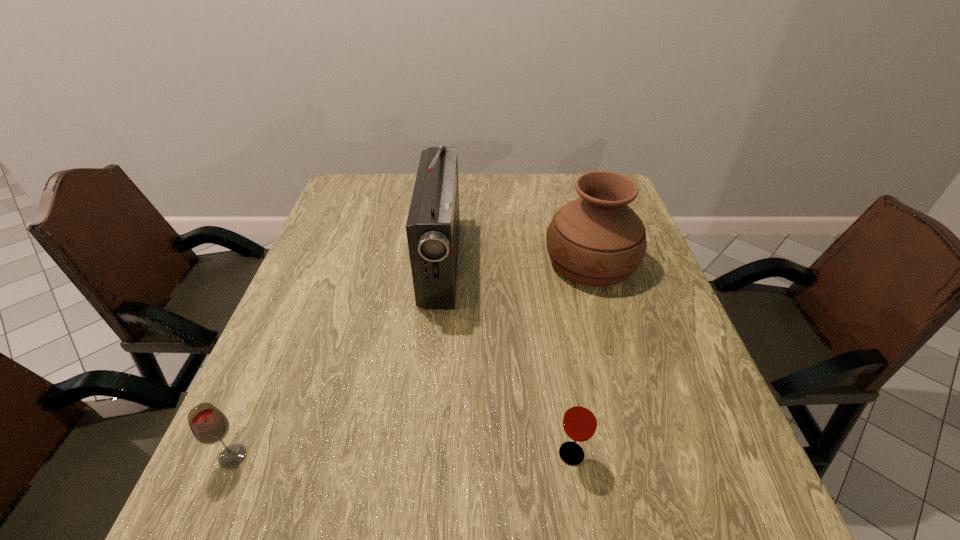
What are the coordinates of `the tallest object` in the screenshot? It's located at (433, 224).

What are the coordinates of `the third object from right to left` in the screenshot? It's located at (433, 224).

Where is `urn`? Image resolution: width=960 pixels, height=540 pixels. urn is located at coordinates (598, 240).

I want to click on the right glass drink container, so click(x=580, y=420).

Where is `the left glass drink container`? Image resolution: width=960 pixels, height=540 pixels. the left glass drink container is located at coordinates (209, 425).

This screenshot has width=960, height=540. I want to click on free space located 0.240m on the front-facing side of the radio receiver, so click(552, 263).

This screenshot has height=540, width=960. What are the coordinates of `blank space located on the front of the urn` in the screenshot? It's located at (605, 309).

Locate an element on the screen. The width and height of the screenshot is (960, 540). vacant space situated 0.050m on the front of the right glass drink container is located at coordinates (579, 500).

The image size is (960, 540). I want to click on free spot located on the front of the leftmost object, so click(214, 501).

Identify the location of object positioned at the left edge. The height and width of the screenshot is (540, 960). (209, 425).